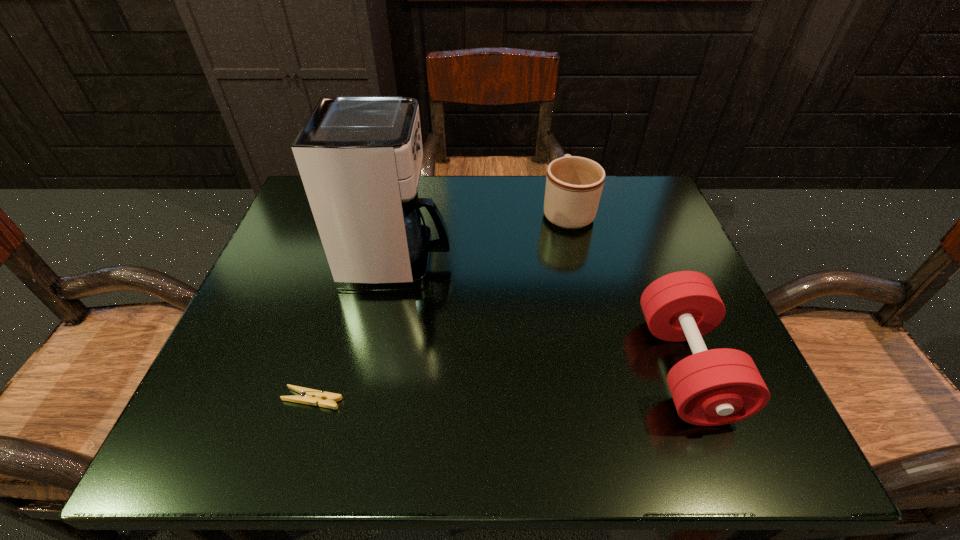
You are a GUI agent. You are given a task and a screenshot of the screen. Output one action in this format:
    pyautogui.click(x=<x>, y=<y>)
    Task: Click on the vacant space located on the right of the clothespin
    Image resolution: width=960 pixels, height=540 pixels.
    Given the screenshot: What is the action you would take?
    pyautogui.click(x=423, y=399)

The image size is (960, 540). Identify the location of coffee maker present at the far edge. (359, 157).

Image resolution: width=960 pixels, height=540 pixels. I want to click on mug located in the far edge section of the desktop, so click(574, 184).

You are a GUI agent. You are given a task and a screenshot of the screen. Output one action in this format:
    pyautogui.click(x=<x>, y=<y>)
    Task: Click on the dumbbell that is at the near edge
    
    Given the screenshot: What is the action you would take?
    pyautogui.click(x=714, y=387)

Find the location of `clothespin positioned at the near edge`. clothespin positioned at the near edge is located at coordinates (308, 396).

The width and height of the screenshot is (960, 540). I want to click on object that is at the left edge, so click(308, 396).

Where is `object situated at the right edge`? object situated at the right edge is located at coordinates [x=714, y=387].

Locate an element on the screen. This screenshot has width=960, height=540. object that is at the near left corner is located at coordinates (308, 396).

I want to click on object that is at the near right corner, so click(x=714, y=387).

The height and width of the screenshot is (540, 960). In order to click on vacant point at the far edge in this screenshot , I will do `click(504, 224)`.